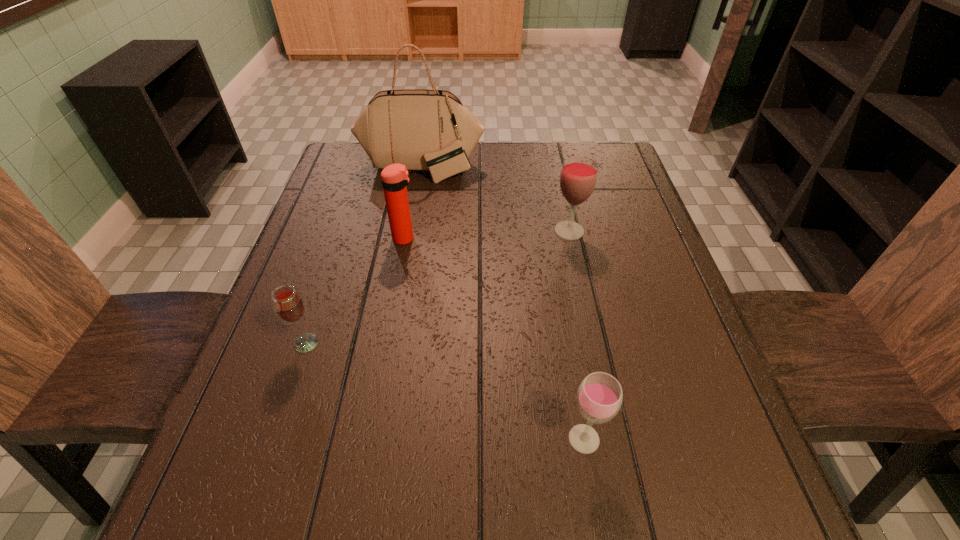
The width and height of the screenshot is (960, 540). I want to click on free space located on the left of the nearest wineglass, so point(405,438).

Locate an element on the screen. The height and width of the screenshot is (540, 960). free space located 0.200m on the front of the leftmost wineglass is located at coordinates (269, 458).

The image size is (960, 540). What are the coordinates of `object present at the far edge` in the screenshot? It's located at (422, 129).

The image size is (960, 540). In order to click on handbag at the left edge in this screenshot , I will do `click(422, 129)`.

Find the location of a particular element. This screenshot has width=960, height=540. wineglass that is at the left edge is located at coordinates (289, 306).

Where is `object that is at the far left corner`? object that is at the far left corner is located at coordinates (422, 129).

Locate an element on the screen. free space at the near edge is located at coordinates (402, 517).

In the image, there is a desktop. Identify the location of vacant space at the left edge. (294, 463).

In the image, there is a desktop. Identify the location of free space at the right edge. This screenshot has height=540, width=960. (699, 386).

Find the location of a particular element. This screenshot has width=960, height=540. vacant position at the far right corner of the desktop is located at coordinates (612, 165).